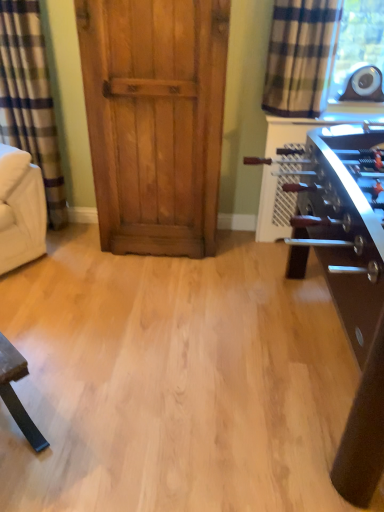
This screenshot has height=512, width=384. Describe the element at coordinates (30, 99) in the screenshot. I see `plaid fabric curtain at left, which appears as the first curtain when viewed from the left` at that location.

This screenshot has height=512, width=384. Find the location of `white fabric armchair at left`. white fabric armchair at left is located at coordinates (20, 209).

How far apart are plaid fabric curtain at upper right, marked as the second curtain in a left-to-right arrangement, and white fabric armchair at left?

plaid fabric curtain at upper right, marked as the second curtain in a left-to-right arrangement, is 5.21 feet away from white fabric armchair at left.

Can white fabric armchair at left be found inside plaid fabric curtain at upper right, marked as the second curtain in a left-to-right arrangement?

That's incorrect, white fabric armchair at left is not inside plaid fabric curtain at upper right, marked as the second curtain in a left-to-right arrangement.

Which of these two, plaid fabric curtain at upper right, marked as the second curtain in a left-to-right arrangement, or white fabric armchair at left, is bigger?

With larger size is white fabric armchair at left.

Is shiny brown table at right outside of plaid fabric curtain at left, which is the 2th curtain in right-to-left order?

Yes, shiny brown table at right is located beyond the bounds of plaid fabric curtain at left, which is the 2th curtain in right-to-left order.

Is shiny brown table at right bigger or smaller than plaid fabric curtain at left, which appears as the first curtain when viewed from the left?

Considering their sizes, shiny brown table at right takes up more space than plaid fabric curtain at left, which appears as the first curtain when viewed from the left.

Considering the relative sizes of shiny brown table at right and plaid fabric curtain at left, which is the 2th curtain in right-to-left order, in the image provided, is shiny brown table at right thinner than plaid fabric curtain at left, which is the 2th curtain in right-to-left order,?

No, shiny brown table at right is not thinner than plaid fabric curtain at left, which is the 2th curtain in right-to-left order.

Consider the image. Is shiny brown table at right touching plaid fabric curtain at left, which is the 2th curtain in right-to-left order?

No, shiny brown table at right is not making contact with plaid fabric curtain at left, which is the 2th curtain in right-to-left order.

Is plaid fabric curtain at upper right, positioned as the first curtain in right-to-left order, not near shiny brown table at right?

plaid fabric curtain at upper right, positioned as the first curtain in right-to-left order, is near shiny brown table at right, not far away.

Considering the relative sizes of plaid fabric curtain at upper right, marked as the second curtain in a left-to-right arrangement, and shiny brown table at right in the image provided, is plaid fabric curtain at upper right, marked as the second curtain in a left-to-right arrangement, bigger than shiny brown table at right?

No.

Looking at their sizes, would you say plaid fabric curtain at upper right, marked as the second curtain in a left-to-right arrangement, is wider or thinner than shiny brown table at right?

In the image, plaid fabric curtain at upper right, marked as the second curtain in a left-to-right arrangement, appears to be more narrow than shiny brown table at right.

Who is bigger, plaid fabric curtain at upper right, positioned as the first curtain in right-to-left order, or wooden door at center?

wooden door at center is bigger.

How far apart are plaid fabric curtain at upper right, marked as the second curtain in a left-to-right arrangement, and wooden door at center?

plaid fabric curtain at upper right, marked as the second curtain in a left-to-right arrangement, is 25.09 inches from wooden door at center.

Between plaid fabric curtain at upper right, marked as the second curtain in a left-to-right arrangement, and wooden door at center, which one has smaller width?

plaid fabric curtain at upper right, marked as the second curtain in a left-to-right arrangement.

Considering the points (283, 1) and (118, 202), which point is behind, point (283, 1) or point (118, 202)?

The point (118, 202) is behind.

Between point (311, 111) and point (27, 130), which one is positioned behind?

The point (27, 130) is farther from the camera.

Does plaid fabric curtain at upper right, marked as the second curtain in a left-to-right arrangement, lie behind plaid fabric curtain at left, which is the 2th curtain in right-to-left order?

No, the depth of plaid fabric curtain at upper right, marked as the second curtain in a left-to-right arrangement, is less than that of plaid fabric curtain at left, which is the 2th curtain in right-to-left order.

Consider the image. Considering the relative sizes of plaid fabric curtain at upper right, positioned as the first curtain in right-to-left order, and plaid fabric curtain at left, which appears as the first curtain when viewed from the left, in the image provided, is plaid fabric curtain at upper right, positioned as the first curtain in right-to-left order, smaller than plaid fabric curtain at left, which appears as the first curtain when viewed from the left,?

Yes, plaid fabric curtain at upper right, positioned as the first curtain in right-to-left order, is smaller than plaid fabric curtain at left, which appears as the first curtain when viewed from the left.

Is plaid fabric curtain at upper right, positioned as the first curtain in right-to-left order, oriented towards plaid fabric curtain at left, which is the 2th curtain in right-to-left order?

No, plaid fabric curtain at upper right, positioned as the first curtain in right-to-left order, is not oriented towards plaid fabric curtain at left, which is the 2th curtain in right-to-left order.

Which is behind, point (327, 217) or point (300, 39)?

The point (300, 39) is behind.

Which object is wider, shiny brown table at right or plaid fabric curtain at upper right, positioned as the first curtain in right-to-left order?

Wider between the two is shiny brown table at right.

Considering the positions of objects shiny brown table at right and plaid fabric curtain at upper right, positioned as the first curtain in right-to-left order, in the image provided, who is more to the right, shiny brown table at right or plaid fabric curtain at upper right, positioned as the first curtain in right-to-left order,?

Positioned to the right is shiny brown table at right.

Between shiny brown table at right and plaid fabric curtain at upper right, marked as the second curtain in a left-to-right arrangement, which one has less height?

Standing shorter between the two is plaid fabric curtain at upper right, marked as the second curtain in a left-to-right arrangement.

Which object is positioned more to the right, wooden door at center or plaid fabric curtain at upper right, positioned as the first curtain in right-to-left order?

Positioned to the right is plaid fabric curtain at upper right, positioned as the first curtain in right-to-left order.

Is wooden door at center shorter than plaid fabric curtain at upper right, positioned as the first curtain in right-to-left order?

In fact, wooden door at center may be taller than plaid fabric curtain at upper right, positioned as the first curtain in right-to-left order.

Does point (213, 91) lie in front of point (313, 115)?

That is True.

Who is bigger, wooden door at center or plaid fabric curtain at upper right, positioned as the first curtain in right-to-left order?

With larger size is wooden door at center.

Find the location of a particular element. This screenshot has width=384, height=512. armchair that appears below the plaid fabric curtain at upper right, marked as the second curtain in a left-to-right arrangement (from a real-world perspective) is located at coordinates (20, 209).

The height and width of the screenshot is (512, 384). I want to click on the 2nd curtain behind the shiny brown table at right, so 30,99.

Based on their spatial positions, is plaid fabric curtain at upper right, marked as the second curtain in a left-to-right arrangement, or wooden door at center further from white fabric armchair at left?

plaid fabric curtain at upper right, marked as the second curtain in a left-to-right arrangement, lies further to white fabric armchair at left than the other object.

From the image, which object appears to be farther from shiny brown table at right, plaid fabric curtain at upper right, positioned as the first curtain in right-to-left order, or wooden door at center?

Based on the image, wooden door at center appears to be further to shiny brown table at right.

Which object lies further to the anchor point shiny brown table at right, white fabric armchair at left or plaid fabric curtain at left, which appears as the first curtain when viewed from the left?

The object further to shiny brown table at right is plaid fabric curtain at left, which appears as the first curtain when viewed from the left.

Looking at the image, which one is located further to wooden door at center, white fabric armchair at left or plaid fabric curtain at left, which is the 2th curtain in right-to-left order?

white fabric armchair at left lies further to wooden door at center than the other object.

Looking at the image, which one is located closer to wooden door at center, shiny brown table at right or plaid fabric curtain at left, which is the 2th curtain in right-to-left order?

plaid fabric curtain at left, which is the 2th curtain in right-to-left order, lies closer to wooden door at center than the other object.

Which object lies further to the anchor point white fabric armchair at left, plaid fabric curtain at upper right, positioned as the first curtain in right-to-left order, or plaid fabric curtain at left, which is the 2th curtain in right-to-left order?

plaid fabric curtain at upper right, positioned as the first curtain in right-to-left order.

Which object lies nearer to the anchor point plaid fabric curtain at left, which appears as the first curtain when viewed from the left, shiny brown table at right or white fabric armchair at left?

Based on the image, white fabric armchair at left appears to be nearer to plaid fabric curtain at left, which appears as the first curtain when viewed from the left.

Which object lies nearer to the anchor point wooden door at center, plaid fabric curtain at upper right, marked as the second curtain in a left-to-right arrangement, or white fabric armchair at left?

plaid fabric curtain at upper right, marked as the second curtain in a left-to-right arrangement, lies closer to wooden door at center than the other object.

This screenshot has width=384, height=512. What are the coordinates of `door situated between plaid fabric curtain at left, which appears as the first curtain when viewed from the left, and plaid fabric curtain at upper right, positioned as the first curtain in right-to-left order, from left to right` in the screenshot? It's located at (155, 120).

I want to click on curtain between white fabric armchair at left and plaid fabric curtain at upper right, positioned as the first curtain in right-to-left order, in the horizontal direction, so click(30, 99).

Identify the location of door between white fabric armchair at left and shiny brown table at right. Image resolution: width=384 pixels, height=512 pixels. (155, 120).

At what (x,y) coordinates should I click in order to perform the action: click on door between shiny brown table at right and plaid fabric curtain at upper right, positioned as the first curtain in right-to-left order, from front to back. Please return your answer as a coordinate pair (x, y). The height and width of the screenshot is (512, 384). Looking at the image, I should click on (155, 120).